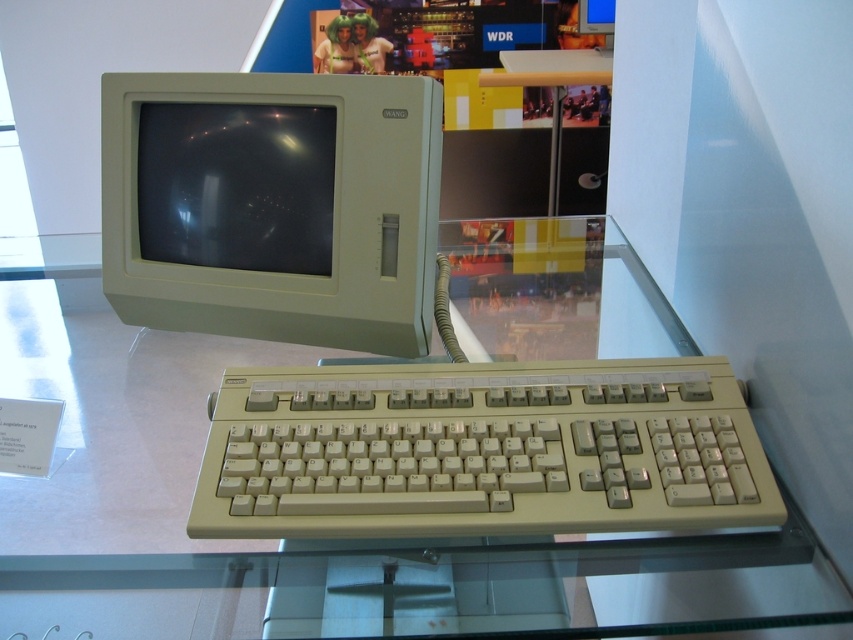
You are a museum visitor standing in front of the vintage Wang computer setup. You notice two monitors labeled beige plastic monitor at upper left and matte plastic monitor at upper left. Which monitor is positioned to the right side of the other?

The beige plastic monitor at upper left is positioned to the right of the matte plastic monitor at upper left.

Based on the photo, you are a museum visitor standing in front of the vintage Wang computer exhibit. You notice the beige plastic keyboard at center and the beige plastic monitor at upper left. Which object is positioned lower in the setup?

The beige plastic keyboard at center is positioned below the beige plastic monitor at upper left, so it is lower in the setup.